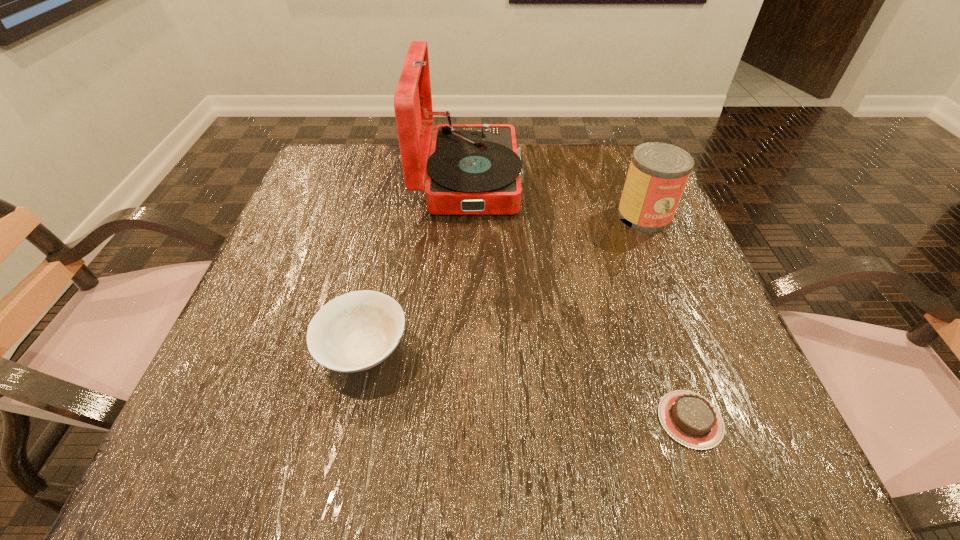
Image resolution: width=960 pixels, height=540 pixels. Identify the location of phonograph_record. (473, 168).

The image size is (960, 540). I want to click on the second tallest object, so click(x=658, y=173).

This screenshot has width=960, height=540. I want to click on the third tallest object, so click(x=356, y=331).

Locate an element on the screen. This screenshot has height=540, width=960. chocolate cake is located at coordinates point(689,418).

The height and width of the screenshot is (540, 960). I want to click on vacant space located on the front-facing side of the tallest object, so click(x=556, y=179).

This screenshot has width=960, height=540. I want to click on blank space located on the back of the can, so click(627, 174).

This screenshot has height=540, width=960. I want to click on vacant space located on the right of the third tallest object, so click(594, 350).

Find the location of a particular element. The width and height of the screenshot is (960, 540). free location located on the left of the shortest object is located at coordinates (435, 420).

Image resolution: width=960 pixels, height=540 pixels. In order to click on phonograph_record that is at the far edge in this screenshot , I will do [x=473, y=168].

At what (x,y) coordinates should I click in order to perform the action: click on can situated at the far edge. Please return your answer as a coordinate pair (x, y). Looking at the image, I should click on (658, 173).